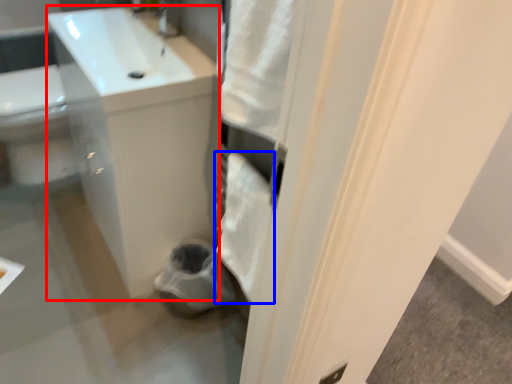
Question: Which object appears closest to the camera in this image, counter top (highlighted by a red box) or bath towel (highlighted by a blue box)?

Choices:
 (A) counter top
 (B) bath towel

Answer: (B)